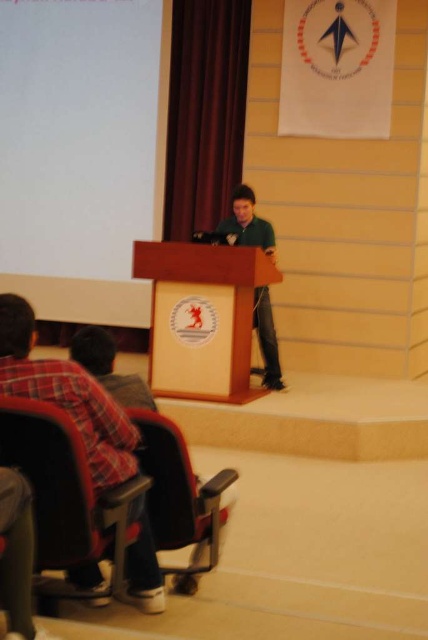
Question: Does matte black chair at lower left appear over green matte shirt at center?

Choices:
 (A) yes
 (B) no

Answer: (B)

Question: Can you confirm if plush fabric chair at lower left is positioned to the left of matte black chair at lower left?

Choices:
 (A) yes
 (B) no

Answer: (A)

Question: Which is nearer to the green matte shirt at center?

Choices:
 (A) wooden podium at center
 (B) plush fabric chair at lower left

Answer: (A)

Question: Does plush fabric chair at lower left have a lesser width compared to green matte shirt at center?

Choices:
 (A) yes
 (B) no

Answer: (A)

Question: Which point is farther to the camera?

Choices:
 (A) plush fabric chair at lower left
 (B) matte black chair at lower left

Answer: (B)

Question: Which point appears closest to the camera in this image?

Choices:
 (A) (270, 234)
 (B) (198, 266)
 (C) (68, 524)

Answer: (C)